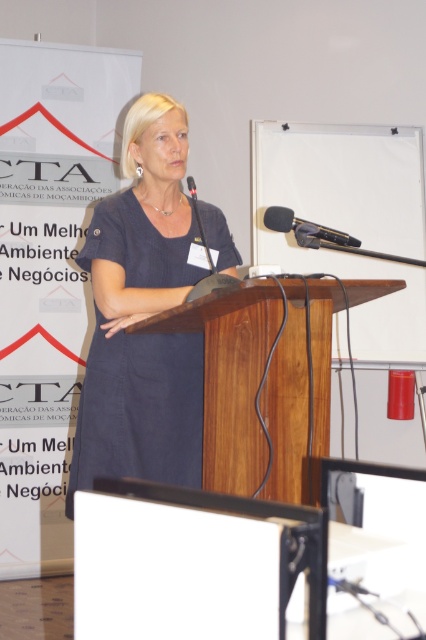
How far apart are black matte microphone at center and black plastic microphone at center?

black matte microphone at center and black plastic microphone at center are 17.51 inches apart.

Between black matte microphone at center and black plastic microphone at center, which one has less height?

Standing shorter between the two is black matte microphone at center.

In order to click on black matte microphone at center in this screenshot , I will do `click(307, 228)`.

Is point (135, 292) in front of point (189, 180)?

Yes, it is in front of point (189, 180).

Which of these two, dark blue dress at center or black plastic microphone at center, stands taller?

With more height is dark blue dress at center.

Who is more forward, (195,483) or (193,188)?

Point (193,188) is in front.

Find the location of a particular element. This screenshot has height=640, width=426. dark blue dress at center is located at coordinates (143, 314).

Who is more forward, (161, 380) or (317, 225)?

Point (317, 225) is in front.

Locate an element on the screen. The image size is (426, 640). dark blue dress at center is located at coordinates (143, 314).

Find the location of a particular element. This screenshot has height=640, width=426. dark blue dress at center is located at coordinates (143, 314).